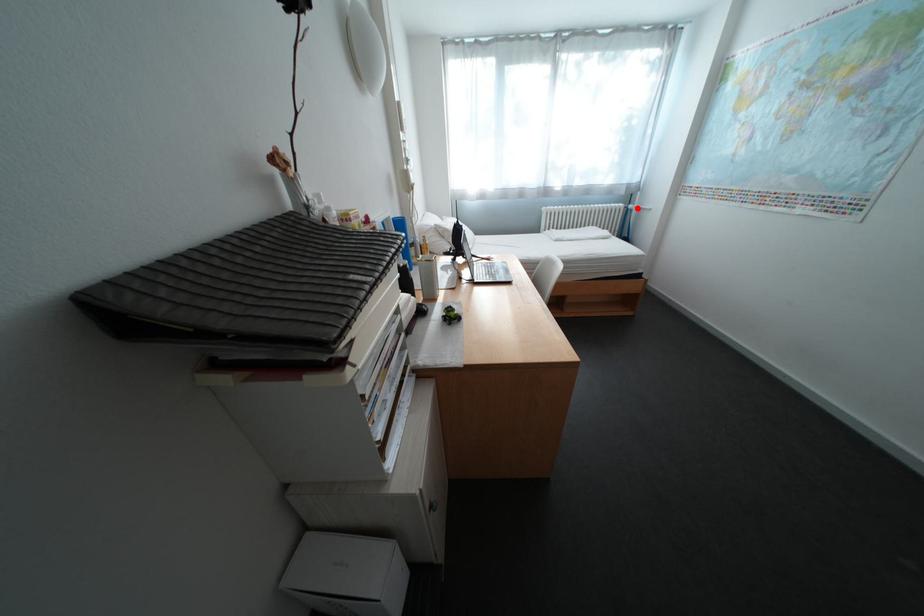
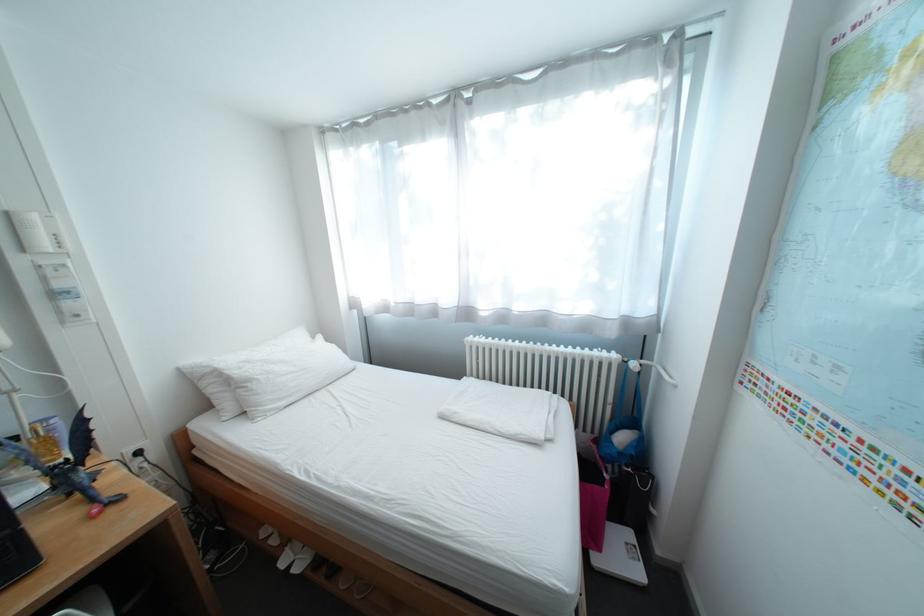
Question: I am providing you with two images of the same scene from different viewpoints. A red point is shown in image1. For the corresponding object point in image2, is it positioned nearer or farther from the camera?

Choices:
 (A) Nearer
 (B) Farther

Answer: (B)